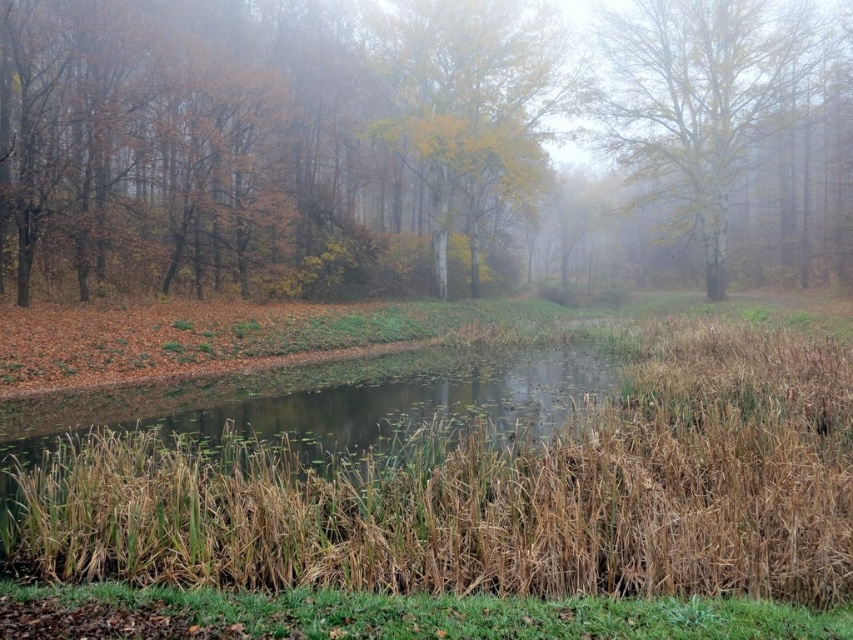
Consider the image. You are standing at the edge of the pond and want to take a photo of the brown dry reed at center. If your camera has a maximum focus range of 6 meters, will it be able to capture the reed clearly?

The brown dry reed at center and camera are 6.72 meters apart from each other. Since the distance exceeds the camera maximum focus range of 6 meters, the camera cannot capture the reed clearly.